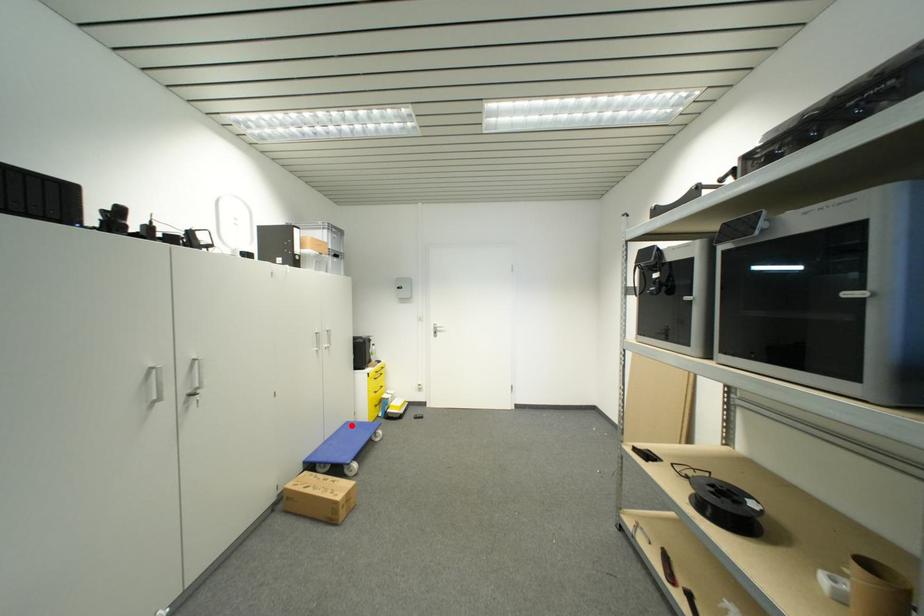
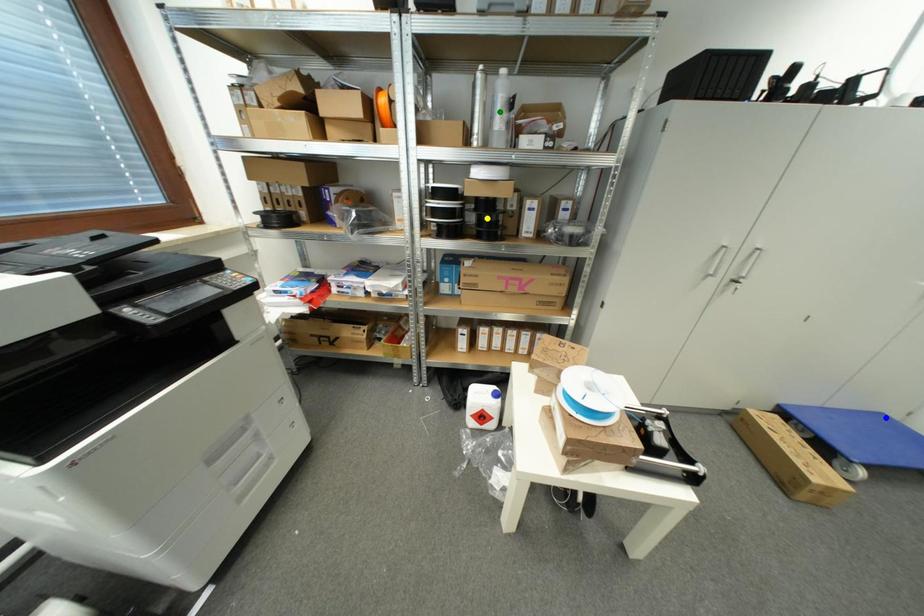
Question: I am providing you with two images of the same scene from different viewpoints. A red point is marked on the first image. You are given multiple points on the second image. Which mark in image 2 goes with the point in image 1?

Choices:
 (A) green point
 (B) yellow point
 (C) blue point

Answer: (C)